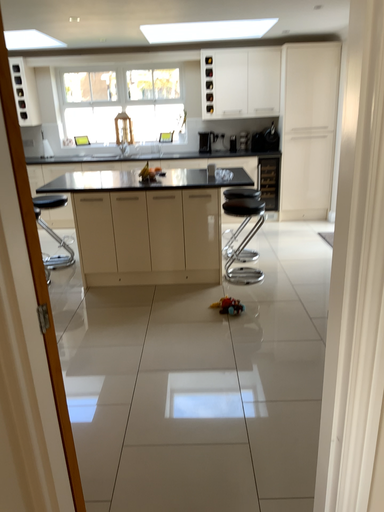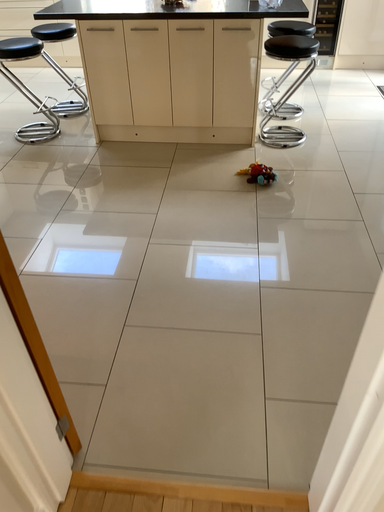
Question: How did the camera likely rotate when shooting the video?

Choices:
 (A) rotated upward
 (B) rotated downward

Answer: (B)